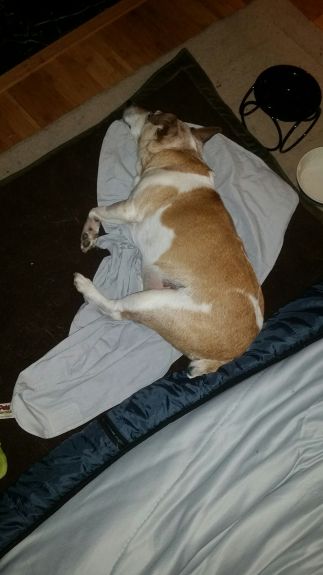
You are a GUI agent. You are given a task and a screenshot of the screen. Output one action in this format:
    pyautogui.click(x=<x>, y=<y>)
    Task: Click on the water bowl
    
    Given the screenshot: What is the action you would take?
    pyautogui.click(x=310, y=172)